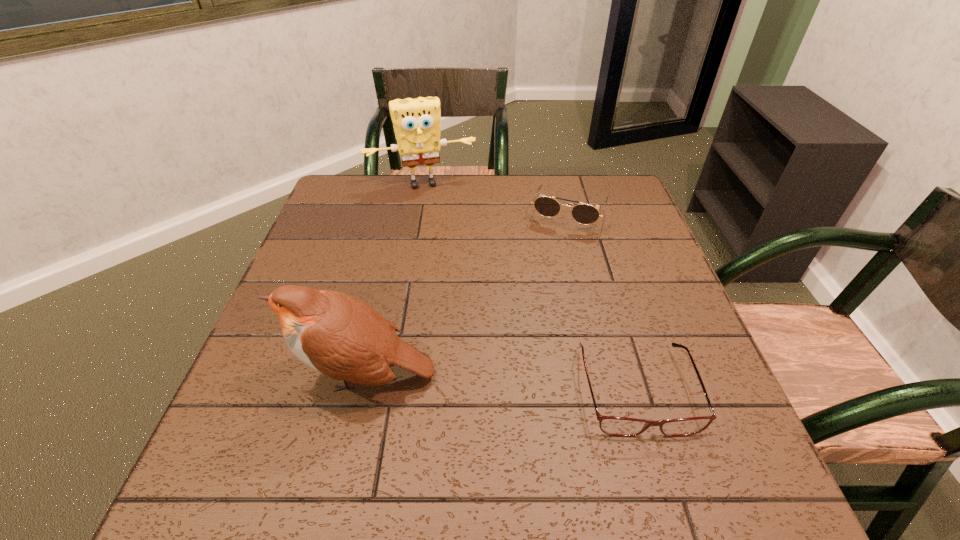
Find the location of a particular element. free space located 0.070m on the face of the sponge is located at coordinates (438, 206).

Identify the location of free point located on the face of the sponge. The width and height of the screenshot is (960, 540). (443, 224).

Where is `sunglasses present at the far edge`? The image size is (960, 540). sunglasses present at the far edge is located at coordinates (585, 214).

The image size is (960, 540). I want to click on sponge located in the far edge section of the desktop, so [416, 122].

Locate an element on the screen. bird at the near edge is located at coordinates (339, 335).

At what (x,y) coordinates should I click in order to perform the action: click on spectacles that is at the near edge. Please return your answer as a coordinate pair (x, y). Image resolution: width=960 pixels, height=540 pixels. Looking at the image, I should click on coord(616,426).

Where is `bird positioned at the left edge`? bird positioned at the left edge is located at coordinates (339, 335).

Identify the location of sponge situated at the left edge. (416, 122).

Locate an element on the screen. spectacles located in the right edge section of the desktop is located at coordinates (616, 426).

What are the coordinates of `sunglasses situated at the right edge` in the screenshot? It's located at (585, 214).